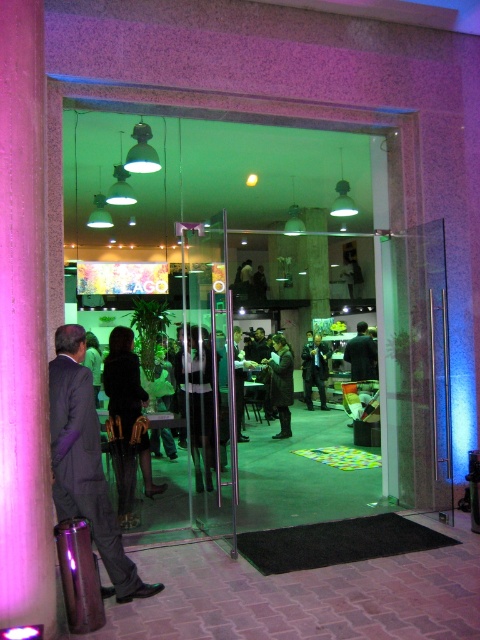
Question: Is matte black suit at left below dark suit at center?

Choices:
 (A) no
 (B) yes

Answer: (A)

Question: Is matte black suit at left positioned at the back of dark green fabric jacket at center?

Choices:
 (A) no
 (B) yes

Answer: (A)

Question: Among these points, which one is nearest to the camera?

Choices:
 (A) (348, 360)
 (B) (325, 368)

Answer: (A)

Question: Which point is farther to the camera?

Choices:
 (A) dark suit at center
 (B) matte black suit at left
 (C) dark green fabric jacket at center
 (D) dark brown leather jacket at center

Answer: (A)

Question: Is dark brown leather jacket at center below dark suit at center?

Choices:
 (A) no
 (B) yes

Answer: (B)

Question: Which object is positioned farthest from the dark suit at center?

Choices:
 (A) dark green fabric jacket at center
 (B) dark brown leather jacket at center
 (C) matte black suit at left

Answer: (C)